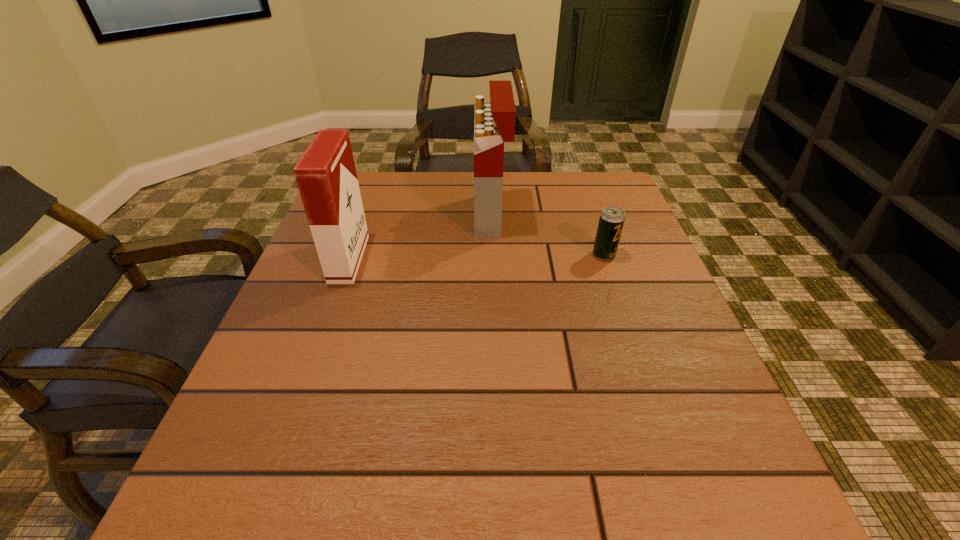
Select which object appears as the closest to the second object from left to right. Please provide its 2D coordinates. Your answer should be formatted as a tuple, i.e. [(x, y)], where the tuple contains the x and y coordinates of a point satisfying the conditions above.

[(611, 221)]

In order to click on vacant point that satisfies the following two spatial constraints: 1. with the lid open on the right cigarette_case; 2. on the left side of the beer can in this screenshot , I will do `click(492, 255)`.

Find the location of a particular element. The image size is (960, 540). free location that satisfies the following two spatial constraints: 1. with the lid open on the shortest object; 2. on the left side of the right cigarette_case is located at coordinates (492, 255).

At what (x,y) coordinates should I click in order to perform the action: click on free location that satisfies the following two spatial constraints: 1. on the front side of the beer can; 2. on the front-facing side of the left cigarette_case. Please return your answer as a coordinate pair (x, y). Image resolution: width=960 pixels, height=540 pixels. Looking at the image, I should click on (605, 259).

This screenshot has height=540, width=960. In order to click on vacant position in the image that satisfies the following two spatial constraints: 1. on the front side of the shortest object; 2. on the front-facing side of the leftmost object in this screenshot , I will do `click(605, 259)`.

This screenshot has height=540, width=960. What are the coordinates of `blank area in the image that satisfies the following two spatial constraints: 1. on the back side of the rightmost object; 2. with the lid open on the right cigarette_case` in the screenshot? It's located at (590, 216).

The height and width of the screenshot is (540, 960). I want to click on vacant space that satisfies the following two spatial constraints: 1. with the lid open on the shortest object; 2. on the left side of the second object from right to left, so click(x=492, y=255).